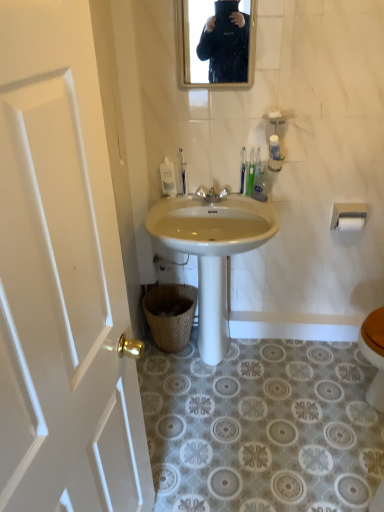
The width and height of the screenshot is (384, 512). I want to click on blank area to the left of green plastic toothbrush at upper center, so click(x=222, y=201).